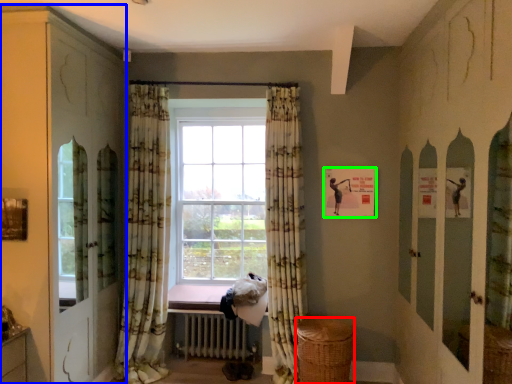
Question: Which object is the closest to the basket (highlighted by a red box)? Choose among these: dresser (highlighted by a blue box) or picture frame (highlighted by a green box).

Choices:
 (A) dresser
 (B) picture frame

Answer: (B)